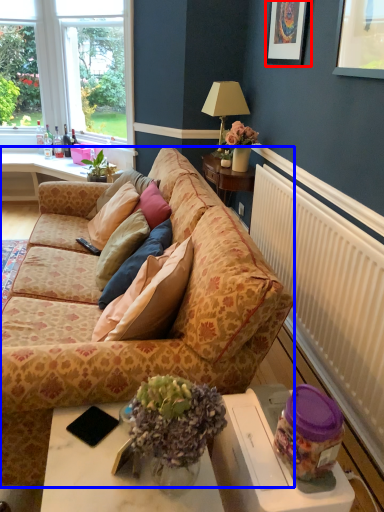
Question: Which object appears farthest to the camera in this image, picture frame (highlighted by a red box) or studio couch (highlighted by a blue box)?

Choices:
 (A) picture frame
 (B) studio couch

Answer: (A)